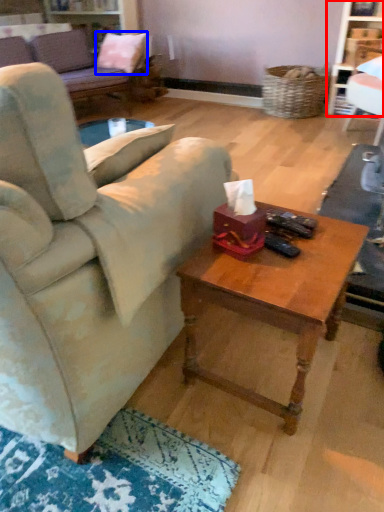
Question: Which object appears farthest to the camera in this image, bookshelf (highlighted by a red box) or pillow (highlighted by a blue box)?

Choices:
 (A) bookshelf
 (B) pillow

Answer: (B)